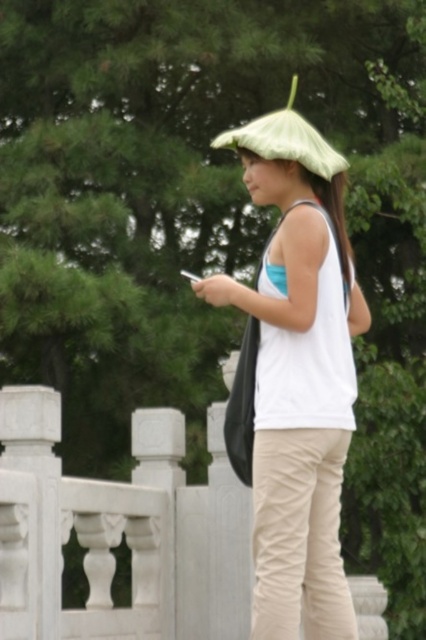
You are a delivery person trying to find the correct address. You see a white stone fence at center in the image. Can you confirm if the point marked at coordinates (x=120, y=531) on the image corresponds to the white stone fence at center?

Yes, the point marked at coordinates (x=120, y=531) corresponds to the white stone fence at center as stated in the objects description.

You are a photographer trying to capture a clear photo of the matte khaki pants at lower center. However, the matte green umbrella at center is blocking your view. Can you move the umbrella to the side to get a better shot?

The matte green umbrella at center is in front of the matte khaki pants at lower center, so moving it to the side would allow you to capture a clear photo of the matte khaki pants at lower center.

You are a photographer trying to capture a candid shot of the person in the scene. The camera you are using has a maximum focus range of 3 meters. Can you ensure that both the matte khaki pants at lower center and the green fabric umbrella at upper center are in focus at the same time?

The matte khaki pants at lower center and green fabric umbrella at upper center are 3.13 meters apart from each other. Since the camera can only focus up to 3 meters, the distance between them exceeds the focus range, so they cannot both be in focus simultaneously.